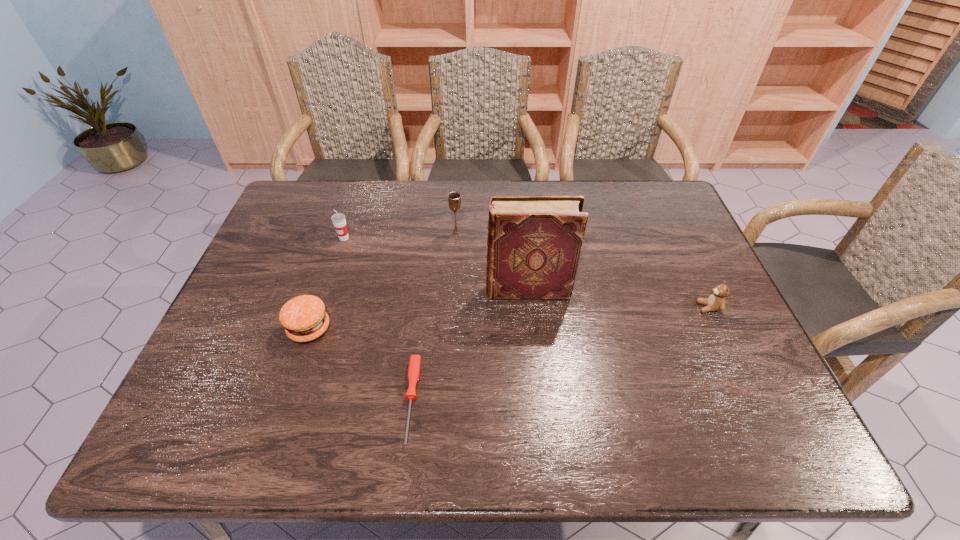
The height and width of the screenshot is (540, 960). What are the coordinates of `the tallest object` in the screenshot? It's located at (534, 242).

This screenshot has height=540, width=960. What are the coordinates of `the second object from right to left` in the screenshot? It's located at (534, 242).

Where is `the fifth shortest object`? The image size is (960, 540). the fifth shortest object is located at coordinates (454, 198).

At what (x,y) coordinates should I click in order to perform the action: click on the fourth object from left to right. Please return your answer as a coordinate pair (x, y). Image resolution: width=960 pixels, height=540 pixels. Looking at the image, I should click on (454, 198).

You are a GUI agent. You are given a task and a screenshot of the screen. Output one action in this format:
    pyautogui.click(x=<x>, y=<y>)
    Task: Click on the cup
    The height and width of the screenshot is (540, 960).
    Given the screenshot: What is the action you would take?
    pyautogui.click(x=338, y=219)

Find the location of a particular element. teddy bear is located at coordinates (716, 301).

Identify the location of patty. The image size is (960, 540). (304, 318).

The image size is (960, 540). In order to click on the shortest object in this screenshot , I will do `click(414, 367)`.

Find the location of a particular element. screwdriver is located at coordinates (414, 367).

Find the location of a particular element. free space located on the spine side of the tallest object is located at coordinates (448, 290).